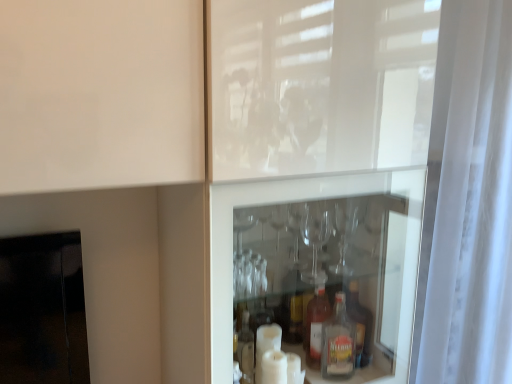
Question: Should I look upward or downward to see white sheer curtain at right?

Choices:
 (A) up
 (B) down

Answer: (B)